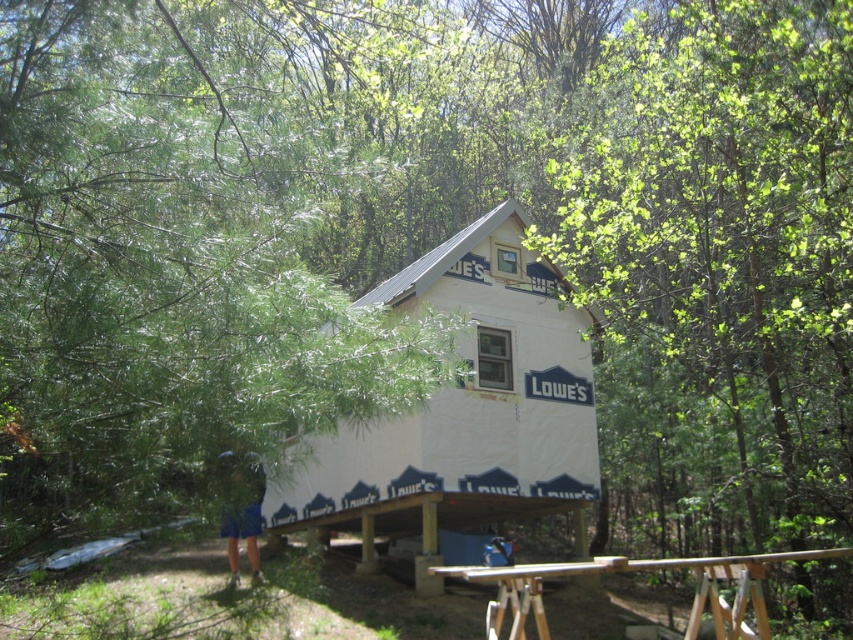
Question: Which of the following is the closest to the observer?

Choices:
 (A) (526, 266)
 (B) (605, 561)

Answer: (B)

Question: Which of the following is the closest to the observer?

Choices:
 (A) (753, 566)
 (B) (155, 35)
 (C) (693, 26)
 (D) (589, 424)

Answer: (A)

Question: Does green leafy tree at upper center appear on the right side of white matte house at center?

Choices:
 (A) yes
 (B) no

Answer: (A)

Question: Does green leafy tree at upper center appear on the right side of white matte house at center?

Choices:
 (A) yes
 (B) no

Answer: (A)

Question: Does green leafy tree at upper left appear over white matte house at center?

Choices:
 (A) no
 (B) yes

Answer: (B)

Question: Among these objects, which one is nearest to the camera?

Choices:
 (A) white matte house at center
 (B) wooden picnic table at lower center
 (C) green leafy tree at upper left
 (D) green leafy tree at upper center

Answer: (C)